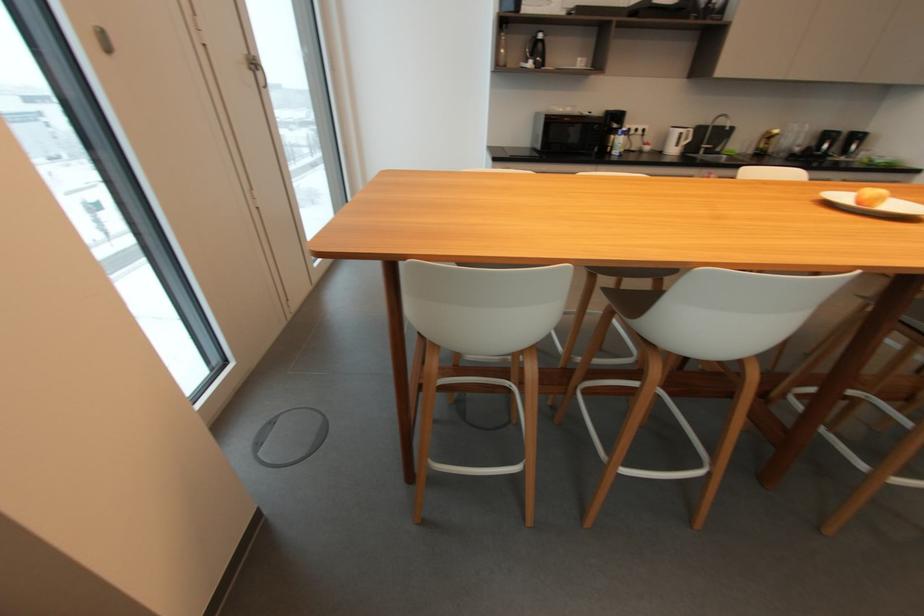
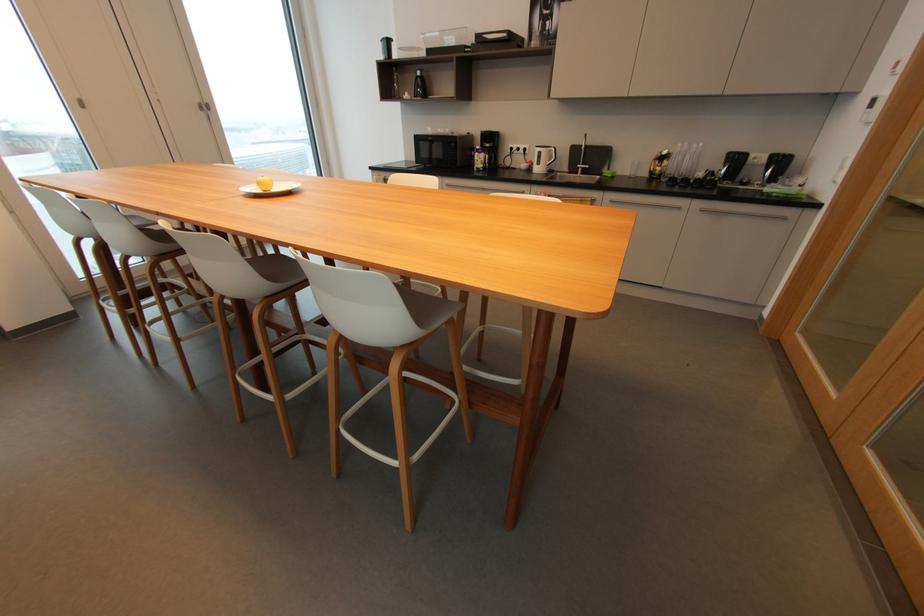
Where in the second image is the point corresponding to point (544, 36) from the first image?

(421, 74)